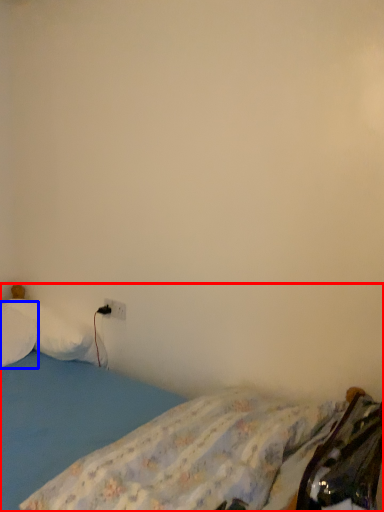
Question: Which of the following is the closest to the observer, bed (highlighted by a red box) or pillow (highlighted by a blue box)?

Choices:
 (A) bed
 (B) pillow

Answer: (A)